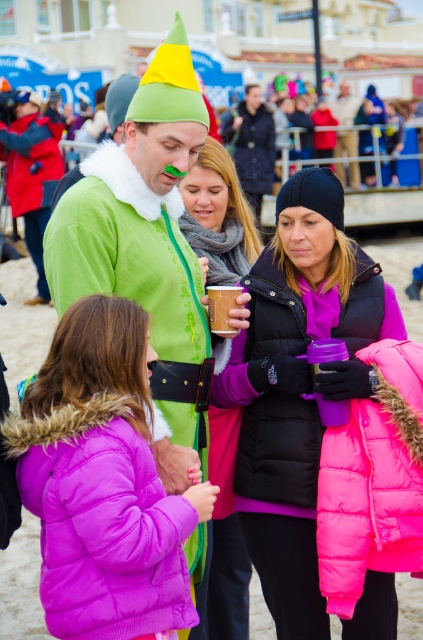
Question: Which point is closer to the camera taking this photo?

Choices:
 (A) (260, 116)
 (B) (227, 180)
 (C) (43, 228)
 (D) (110, 512)

Answer: (D)

Question: Does green felt costume at center have a smaller size compared to pink matte cup at center?

Choices:
 (A) yes
 (B) no

Answer: (B)

Question: Which of the following is the farthest from the observer?

Choices:
 (A) (376, 104)
 (B) (197, 208)
 (C) (249, 320)
 (D) (345, 120)

Answer: (A)

Question: Is green felt costume at center to the right of pink fuzzy coat at center from the viewer's perspective?

Choices:
 (A) yes
 (B) no

Answer: (B)

Question: Which point appears farthest from the camera in this image?

Choices:
 (A) (192, 403)
 (B) (222, 323)

Answer: (B)

Question: Can you confirm if matte brown paper cup at center is bigger than pink fuzzy coat at center?

Choices:
 (A) no
 (B) yes

Answer: (A)